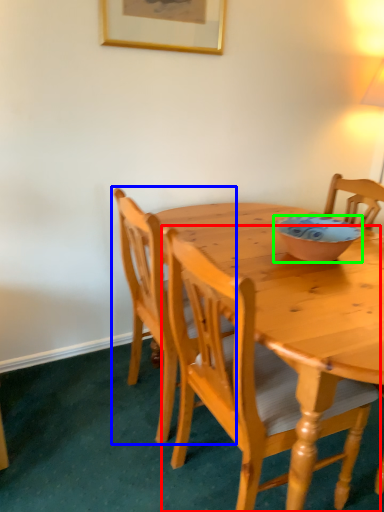
Question: Which object is the farthest from chair (highlighted by a red box)? Choose among these: chair (highlighted by a blue box) or bowl (highlighted by a green box).

Choices:
 (A) chair
 (B) bowl

Answer: (B)